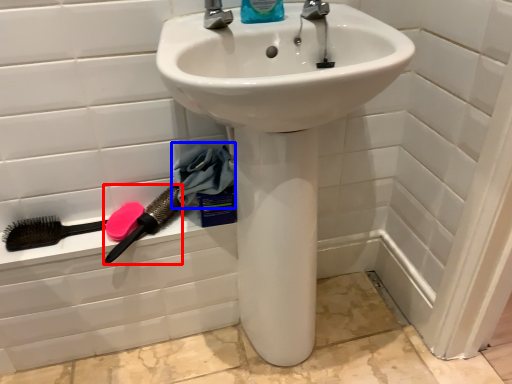
Question: Which object appears farthest to the camera in this image, brush (highlighted by a red box) or material (highlighted by a blue box)?

Choices:
 (A) brush
 (B) material

Answer: (B)